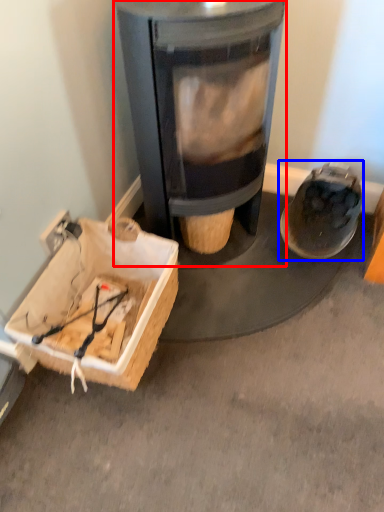
Question: Among these objects, which one is farthest to the camera, wood burning stove (highlighted by a red box) or footwear (highlighted by a blue box)?

Choices:
 (A) wood burning stove
 (B) footwear

Answer: (B)